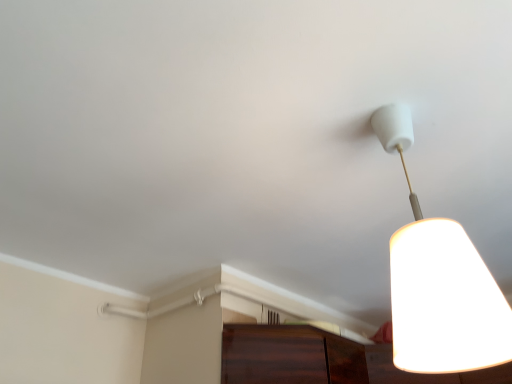
What do you see at coordinates (439, 283) in the screenshot?
I see `white matte lampshade at upper right` at bounding box center [439, 283].

Identify the location of white matte lampshade at upper right. The width and height of the screenshot is (512, 384). (439, 283).

Locate an element on the screen. The height and width of the screenshot is (384, 512). white matte lampshade at upper right is located at coordinates (439, 283).